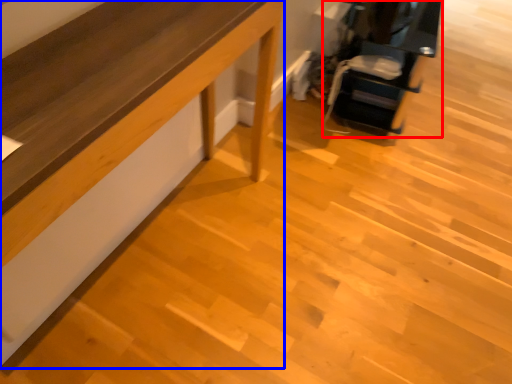
Question: Which of the following is the closest to the observer, furniture (highlighted by a red box) or furniture (highlighted by a blue box)?

Choices:
 (A) furniture
 (B) furniture

Answer: (B)